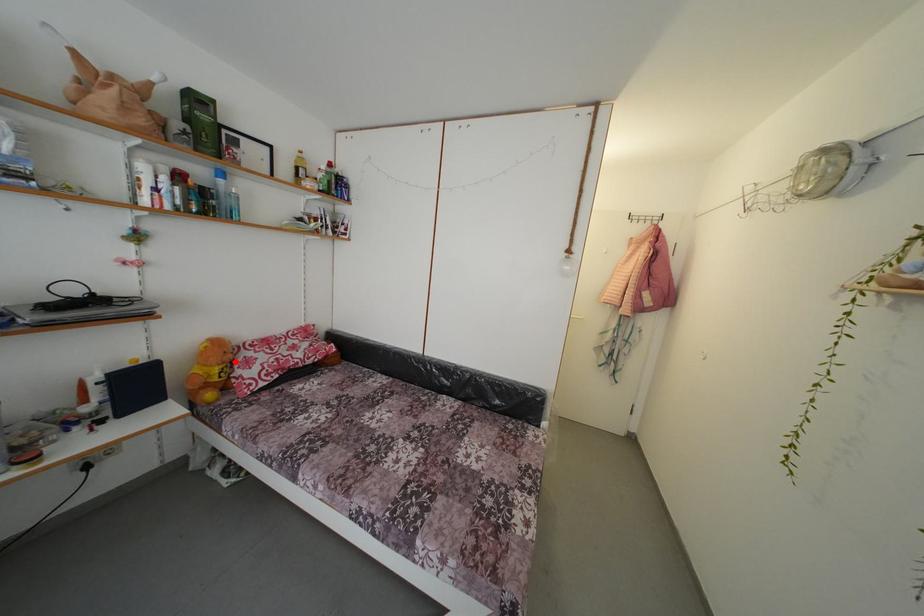
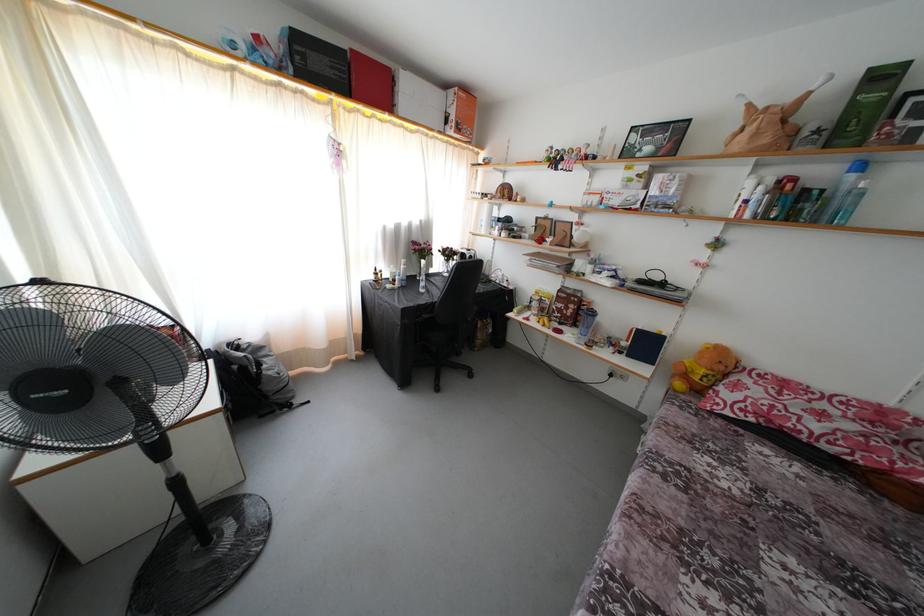
Question: I am providing you with two images of the same scene from different viewpoints. A red point is marked on the first image. Is the red point's position out of view in image 2?

Choices:
 (A) Yes
 (B) No

Answer: (B)